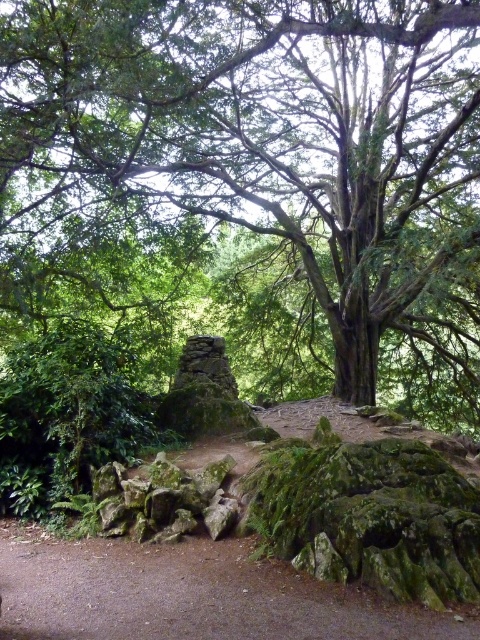
Question: Observing the image, what is the correct spatial positioning of green leafy tree at center in reference to brown dirt path at center?

Choices:
 (A) right
 (B) left

Answer: (A)

Question: Which of the following is the closest to the observer?

Choices:
 (A) (87, 122)
 (B) (411, 628)

Answer: (B)

Question: Among these objects, which one is nearest to the camera?

Choices:
 (A) brown dirt path at center
 (B) green leafy tree at center

Answer: (A)

Question: Is green leafy tree at center below brown dirt path at center?

Choices:
 (A) yes
 (B) no

Answer: (B)

Question: Among these points, which one is farthest from the camera?

Choices:
 (A) (432, 152)
 (B) (79, 616)

Answer: (A)

Question: Is green leafy tree at center to the left of brown dirt path at center from the viewer's perspective?

Choices:
 (A) no
 (B) yes

Answer: (A)